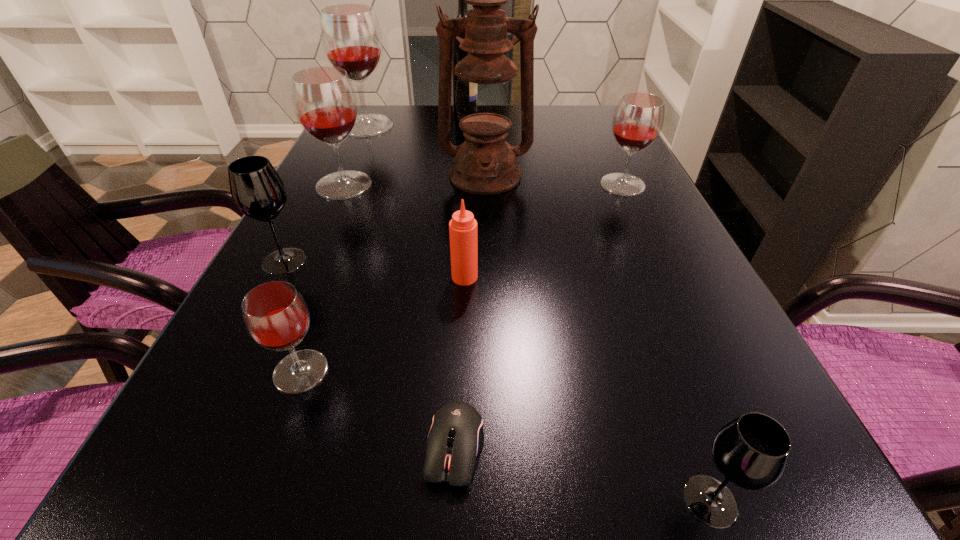
Select which wineglass is the closest to the nearest red wineglass. Please provide its 2D coordinates. Your answer should be formatted as a tuple, i.e. [(x, y)], where the tuple contains the x and y coordinates of a point satisfying the conditions above.

[(257, 190)]

You are a GUI agent. You are given a task and a screenshot of the screen. Output one action in this format:
    pyautogui.click(x=<x>, y=<y>)
    Task: Click on the second closest red wineglass to the farthest red wineglass
    
    Given the screenshot: What is the action you would take?
    [638, 119]

Locate which red wineglass ranks second in proximity to the oil lamp. Please provide its 2D coordinates. Your answer should be formatted as a tuple, i.e. [(x, y)], where the tuple contains the x and y coordinates of a point satisfying the conditions above.

[(638, 119)]

I want to click on free point that satisfies the following two spatial constraints: 1. on the label of the wine bottle; 2. on the left side of the oil lamp, so click(x=461, y=176).

You are a GUI agent. You are given a task and a screenshot of the screen. Output one action in this format:
    pyautogui.click(x=<x>, y=<y>)
    Task: Click on the blank space that satisfies the following two spatial constraints: 1. on the back side of the second smallest red wineglass; 2. on the right side of the computer mouse
    The image size is (960, 540).
    Given the screenshot: What is the action you would take?
    pyautogui.click(x=467, y=185)

The width and height of the screenshot is (960, 540). Identify the location of free space that satisfies the following two spatial constraints: 1. on the label of the black wine bottle; 2. on the back side of the right gray wineglass. (441, 501).